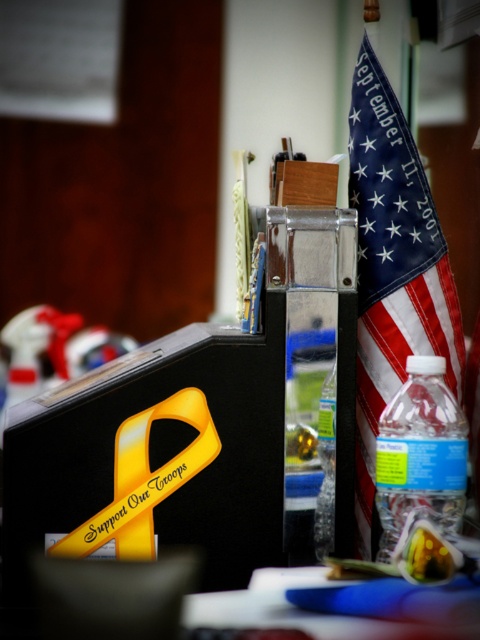
You are organizing items on a desk and need to place the blue fabric flag at right and the blue plastic folder at lower center into a drawer. The drawer has a width that can only accommodate items up to 5 cm in thickness. Which item is more likely to fit without bending or folding?

The blue fabric flag at right is thinner than the blue plastic folder at lower center, so the blue fabric flag at right is more likely to fit in the drawer without bending or folding.

You are organizing items on a desk. You have a blue fabric flag at right and a blue plastic folder at lower center. Which item is placed above the other?

The blue fabric flag at right is positioned over the blue plastic folder at lower center, meaning it is placed above the folder.